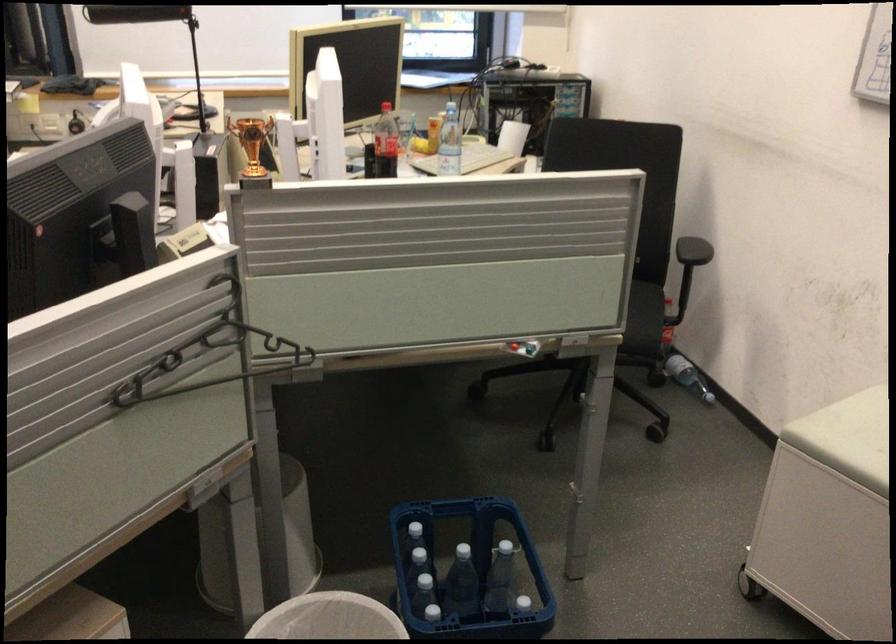
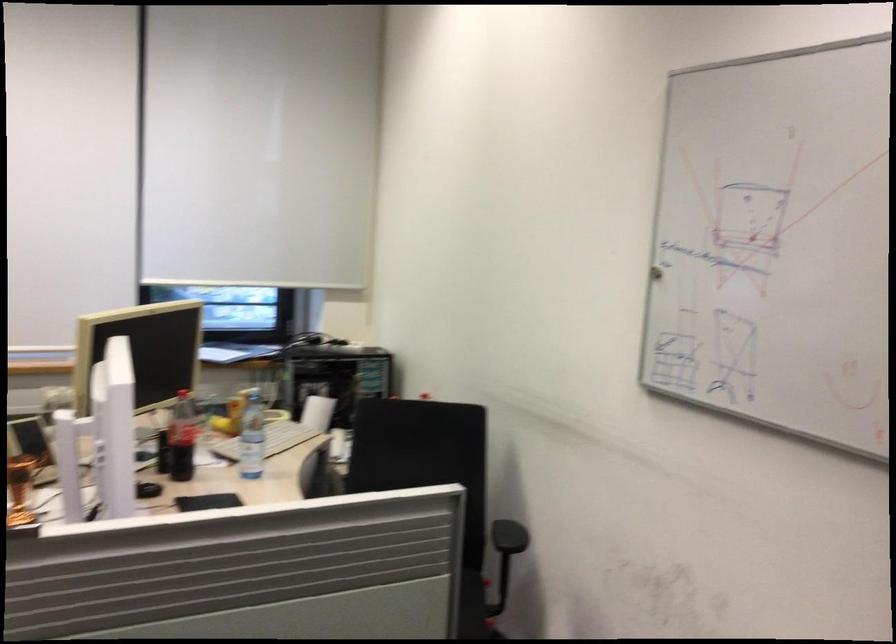
Question: What movement of the cameraman would produce the second image?

Choices:
 (A) Left
 (B) Right
 (C) Forward
 (D) Backward

Answer: (C)